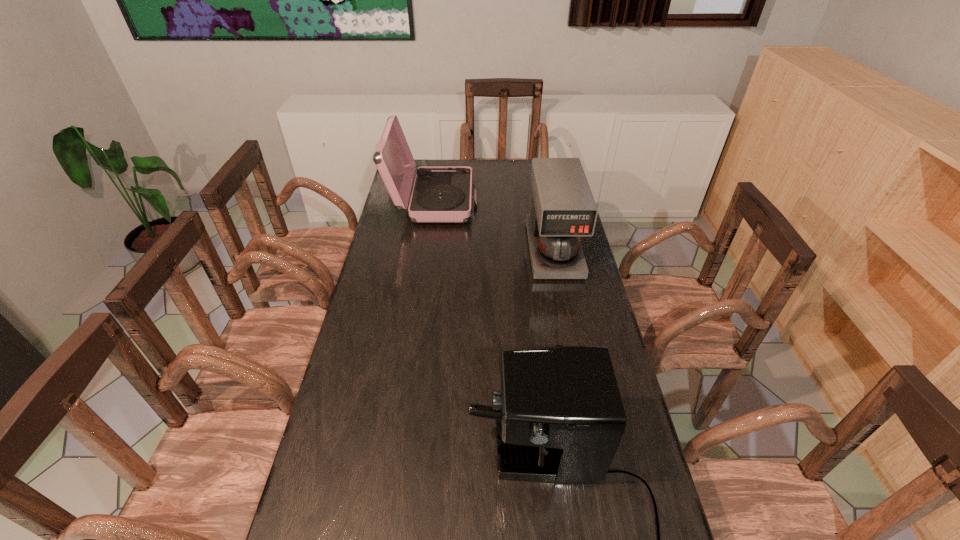
Identify the location of vacant area at the right edge. (563, 299).

I want to click on empty space between the farther coffee maker and the record player, so click(x=493, y=226).

Where is `free space between the farther coffee maker and the record player`? This screenshot has height=540, width=960. free space between the farther coffee maker and the record player is located at coordinates (493, 226).

The image size is (960, 540). I want to click on empty location between the farther coffee maker and the record player, so click(x=493, y=226).

Where is `unoccupied position between the farther coffee maker and the record player`? unoccupied position between the farther coffee maker and the record player is located at coordinates (493, 226).

Find the location of `free space between the record player and the farther coffee maker`. free space between the record player and the farther coffee maker is located at coordinates (493, 226).

Identify which object is the closest to the nearest object. Please provide its 2D coordinates. Your answer should be formatted as a tuple, i.e. [(x, y)], where the tuple contains the x and y coordinates of a point satisfying the conditions above.

[(563, 208)]

Identify which object is the nearest to the nearest object. Please provide its 2D coordinates. Your answer should be formatted as a tuple, i.e. [(x, y)], where the tuple contains the x and y coordinates of a point satisfying the conditions above.

[(563, 208)]